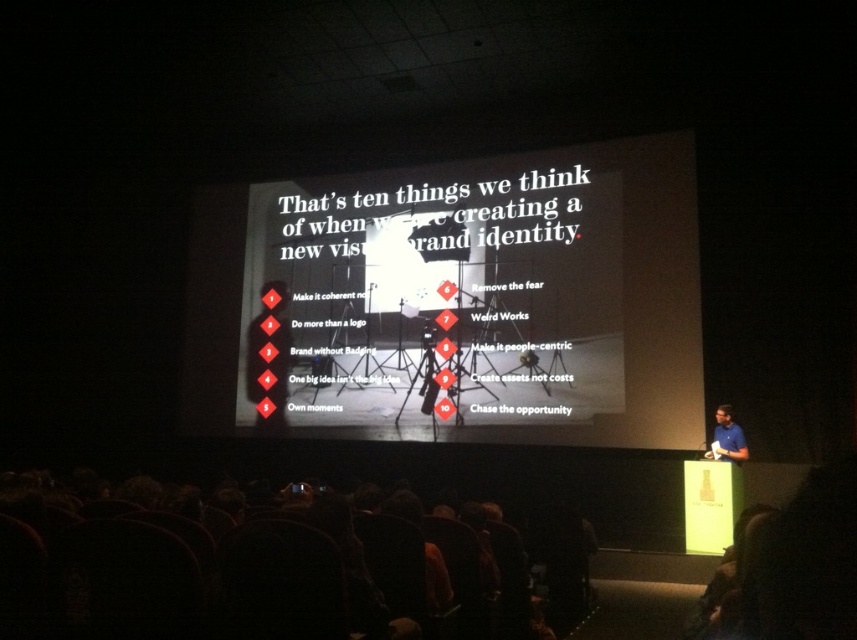
Question: Among these points, which one is farthest from the camera?

Choices:
 (A) (457, 372)
 (B) (734, 440)

Answer: (A)

Question: Which point is farther to the camera?

Choices:
 (A) blue shirt at right
 (B) white paper at center

Answer: (B)

Question: Can you confirm if white paper at center is bigger than blue shirt at right?

Choices:
 (A) yes
 (B) no

Answer: (A)

Question: Is white paper at center positioned behind blue shirt at right?

Choices:
 (A) yes
 (B) no

Answer: (A)

Question: Is white paper at center wider than blue shirt at right?

Choices:
 (A) yes
 (B) no

Answer: (A)

Question: Which point appears closest to the camera in this image?

Choices:
 (A) (724, 429)
 (B) (256, 218)

Answer: (A)